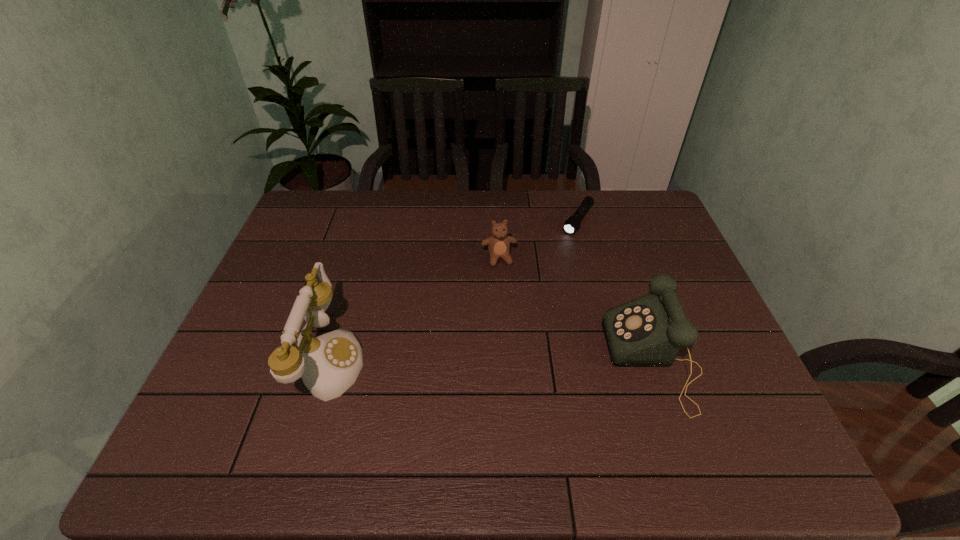
The width and height of the screenshot is (960, 540). What are the coordinates of `the tallest object` in the screenshot? It's located at (329, 364).

At what (x,y) coordinates should I click in order to perform the action: click on the taller telephone. Please return your answer as a coordinate pair (x, y). Looking at the image, I should click on (329, 364).

Locate an element on the screen. The width and height of the screenshot is (960, 540). the right telephone is located at coordinates (646, 332).

You are a GUI agent. You are given a task and a screenshot of the screen. Output one action in this format:
    pyautogui.click(x=<x>, y=<y>)
    Task: Click on the shorter telephone
    
    Given the screenshot: What is the action you would take?
    pyautogui.click(x=646, y=332)

You are a GUI agent. You are given a task and a screenshot of the screen. Output one action in this format:
    pyautogui.click(x=<x>, y=<y>)
    Task: Click on the teddy bear
    
    Given the screenshot: What is the action you would take?
    click(498, 244)

Locate an element on the screen. The image size is (960, 540). the third object from right to left is located at coordinates (498, 244).

Locate an element on the screen. This screenshot has width=960, height=540. flashlight is located at coordinates point(572,224).

I want to click on the farthest object, so click(572, 224).

Identify the location of free region located on the dial of the leftmost object. The height and width of the screenshot is (540, 960). (385, 360).

The height and width of the screenshot is (540, 960). I want to click on blank space located 0.240m on the dial of the shorter telephone, so click(x=510, y=360).